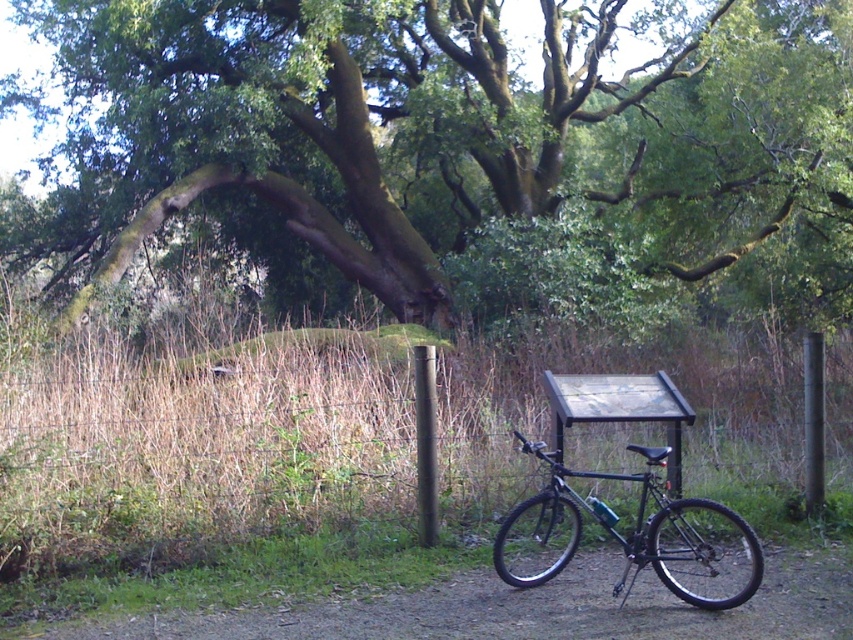
Is black metallic bicycle at lower right to the left of black metallic pole at center from the viewer's perspective?

Incorrect, black metallic bicycle at lower right is not on the left side of black metallic pole at center.

Between black metallic bicycle at lower right and black metallic pole at center, which one is positioned lower?

black metallic bicycle at lower right

Where is `black metallic bicycle at lower right`? black metallic bicycle at lower right is located at coordinates (625, 538).

Between dirt path at center and black metallic bicycle at lower right, which one has more height?

black metallic bicycle at lower right is taller.

Who is shorter, dirt path at center or black metallic bicycle at lower right?

Standing shorter between the two is dirt path at center.

Where is `dirt path at center`? This screenshot has height=640, width=853. dirt path at center is located at coordinates (527, 609).

Identify the location of dirt path at center. This screenshot has height=640, width=853. (527, 609).

Is green mossy tree at upper center below black metallic bicycle at lower right?

No, green mossy tree at upper center is not below black metallic bicycle at lower right.

Does green mossy tree at upper center have a smaller size compared to black metallic bicycle at lower right?

No, green mossy tree at upper center is not smaller than black metallic bicycle at lower right.

Locate an element on the screen. green mossy tree at upper center is located at coordinates (440, 132).

Identify the location of green mossy tree at upper center. (440, 132).